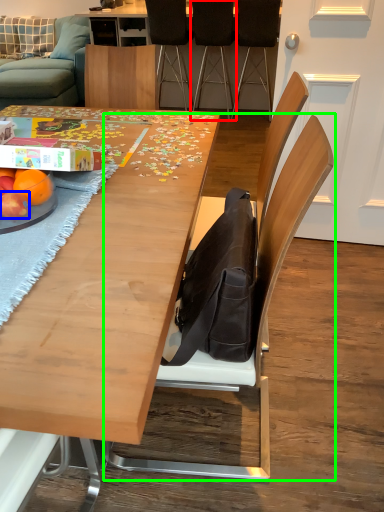
Question: Which object is the farthest from chair (highlighted by a red box)? Choose among these: apple (highlighted by a blue box) or chair (highlighted by a green box).

Choices:
 (A) apple
 (B) chair

Answer: (A)